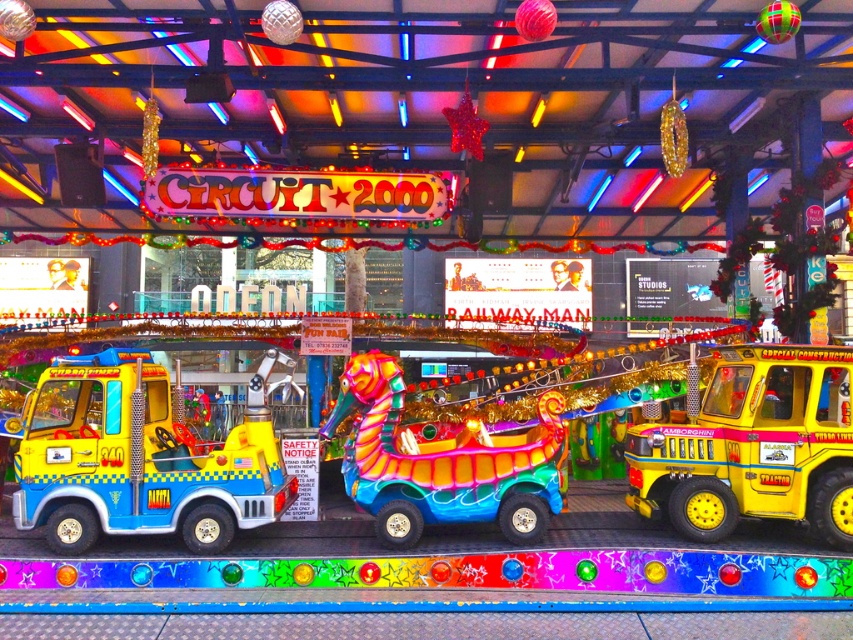
At what (x,y) coordinates should I click in order to perform the action: click on yellow matte tow truck at left. Please return your answer as a coordinate pair (x, y). This screenshot has height=640, width=853. Looking at the image, I should click on (141, 458).

Based on the photo, is the position of yellow matte tow truck at left more distant than that of yellow matte construction vehicle at right?

Yes, it is.

Which is behind, point (148, 456) or point (846, 529)?

The point (148, 456) is behind.

Where is `yellow matte tow truck at left`? The width and height of the screenshot is (853, 640). yellow matte tow truck at left is located at coordinates (141, 458).

In the scene shown: Does yellow matte construction vehicle at right come behind shiny metallic seahorse at center?

No.

Between point (677, 522) and point (387, 412), which one is positioned behind?

Positioned behind is point (387, 412).

At what (x,y) coordinates should I click in order to perform the action: click on yellow matte construction vehicle at right. Please return your answer as a coordinate pair (x, y). This screenshot has width=853, height=640. Looking at the image, I should click on (753, 445).

Is yellow matte tow truck at left smaller than shiny metallic seahorse at center?

No.

Is yellow matte tow truck at left bigger than shiny metallic seahorse at center?

Correct, yellow matte tow truck at left is larger in size than shiny metallic seahorse at center.

Does point (126, 449) come farther from viewer compared to point (540, 493)?

No, it is in front of (540, 493).

This screenshot has width=853, height=640. Identify the location of yellow matte tow truck at left. (141, 458).